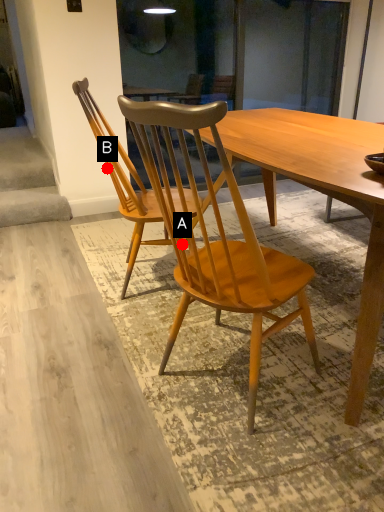
Question: Two points are circled on the image, labeled by A and B beside each circle. Among these points, which one is nearest to the camera?

Choices:
 (A) A is closer
 (B) B is closer

Answer: (A)